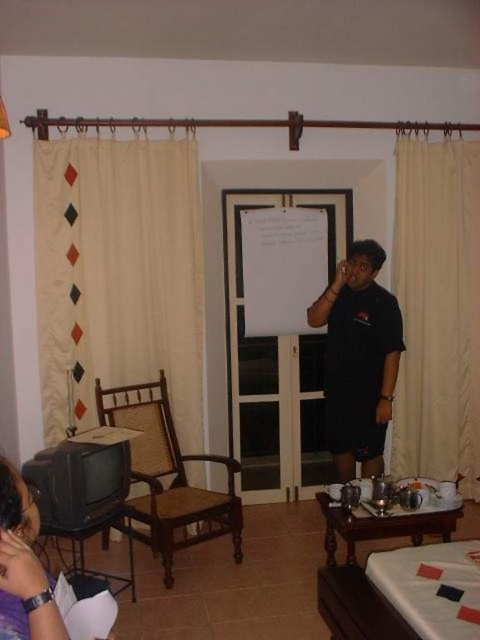
Question: Which of these objects is positioned farthest from the black matte shirt at center?

Choices:
 (A) beige fabric curtain at left
 (B) brown woven armchair at left

Answer: (A)

Question: Is the position of beige fabric curtain at left less distant than that of matte purple shirt at lower left?

Choices:
 (A) yes
 (B) no

Answer: (B)

Question: Which of the following is the farthest from the observer?

Choices:
 (A) (478, 166)
 (B) (75, 202)
 (C) (356, 440)

Answer: (A)

Question: Is beige fabric curtain at left bigger than brown woven armchair at left?

Choices:
 (A) yes
 (B) no

Answer: (B)

Question: Which point is farther from the camera taking this photo?

Choices:
 (A) (110, 342)
 (B) (182, 493)
 (C) (411, 253)

Answer: (C)

Question: Can you confirm if beige fabric curtain at left is positioned below black matte shirt at center?

Choices:
 (A) no
 (B) yes

Answer: (A)